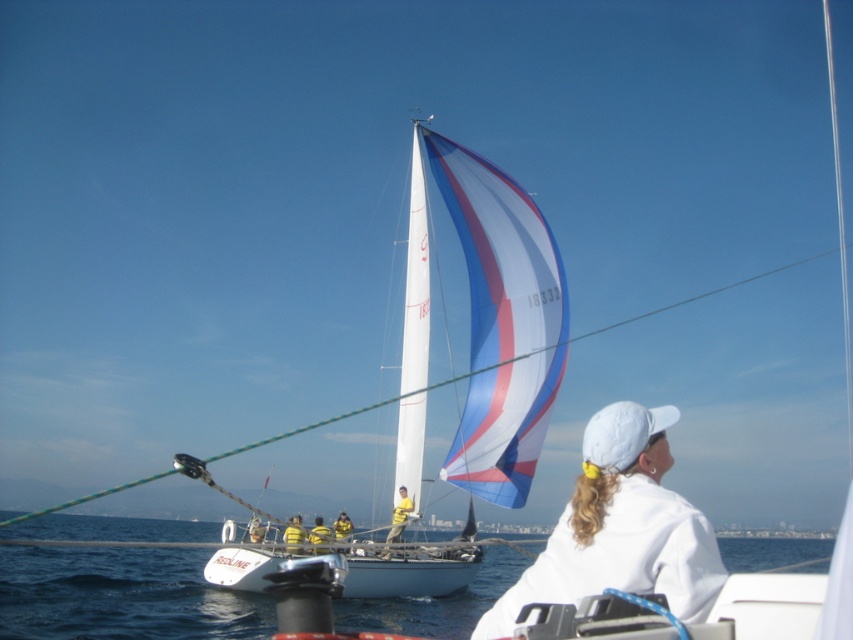
Question: Which object is closer to the camera taking this photo?

Choices:
 (A) white sail at center
 (B) yellow fabric shirt at center
 (C) blue water at lower center
 (D) white matte baseball cap at upper center

Answer: (D)

Question: Based on their relative distances, which object is nearer to the white matte baseball cap at upper center?

Choices:
 (A) blue water at lower center
 (B) yellow fabric shirt at center
 (C) white sail at center

Answer: (B)

Question: Can you confirm if blue water at lower center is positioned to the right of white matte baseball cap at upper center?

Choices:
 (A) no
 (B) yes

Answer: (A)

Question: Is the position of blue water at lower center more distant than that of yellow fabric shirt at center?

Choices:
 (A) no
 (B) yes

Answer: (A)

Question: Does white sail at center have a lesser width compared to yellow fabric shirt at center?

Choices:
 (A) no
 (B) yes

Answer: (A)

Question: Which point is farther to the camera?

Choices:
 (A) (428, 140)
 (B) (590, 419)
 (C) (479, 600)

Answer: (B)